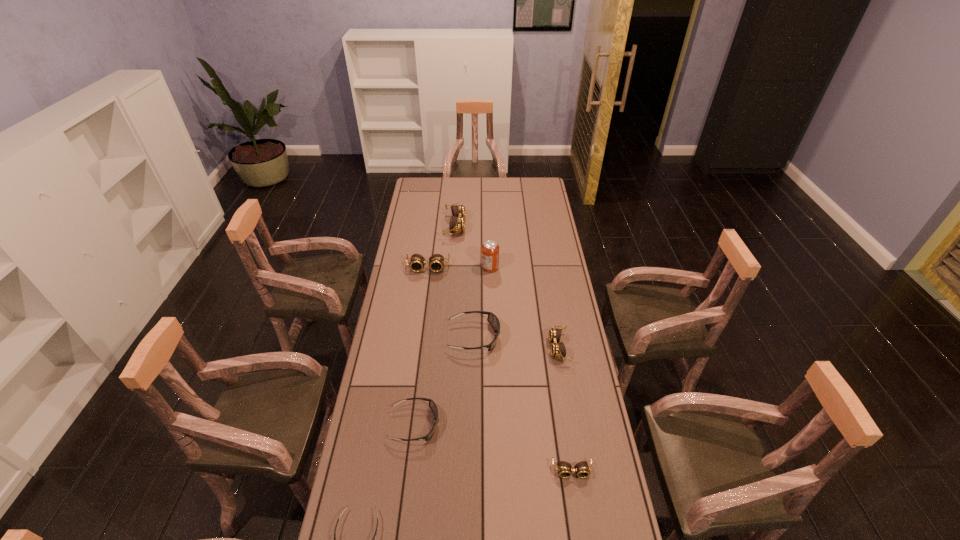
The width and height of the screenshot is (960, 540). I want to click on black goggles object that ranks as the closest to the second nearest black goggles, so click(x=373, y=539).

Identify which black goggles is the second nearest to the nearest object. Please provide its 2D coordinates. Your answer should be formatted as a tuple, i.e. [(x, y)], where the tuple contains the x and y coordinates of a point satisfying the conditions above.

[(492, 318)]

Locate an element on the screen. Image resolution: width=960 pixels, height=540 pixels. free space in the image that satisfies the following two spatial constraints: 1. through the lenses of the second tallest object; 2. on the left side of the tallest object is located at coordinates (452, 268).

Locate an element on the screen. free location that satisfies the following two spatial constraints: 1. through the lenses of the biggest brown goggles; 2. through the lenses of the second farthest goggles is located at coordinates (452, 268).